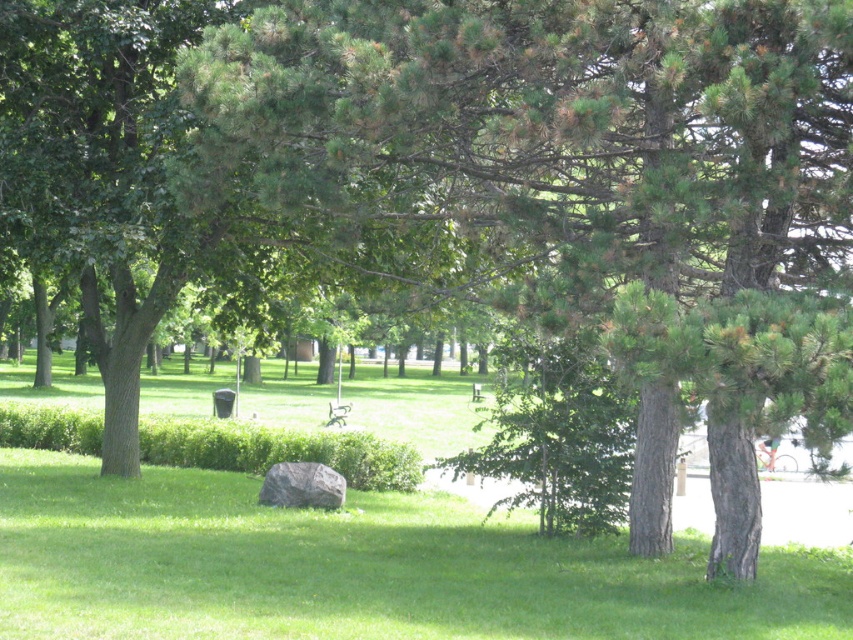
Question: Where is green textured tree at center located in relation to wooden park bench at center in the image?

Choices:
 (A) right
 (B) left

Answer: (A)

Question: Among these points, which one is nearest to the camera?

Choices:
 (A) (834, 304)
 (B) (347, 413)

Answer: (A)

Question: Is green textured tree at center to the left of gray rough boulder at center from the viewer's perspective?

Choices:
 (A) yes
 (B) no

Answer: (B)

Question: Which point is closer to the camera?

Choices:
 (A) green textured tree at center
 (B) gray rough boulder at center

Answer: (A)

Question: Is green textured tree at center smaller than gray rough boulder at center?

Choices:
 (A) no
 (B) yes

Answer: (B)

Question: Among these objects, which one is farthest from the camera?

Choices:
 (A) wooden park bench at center
 (B) green textured tree at center
 (C) gray rough boulder at center

Answer: (A)